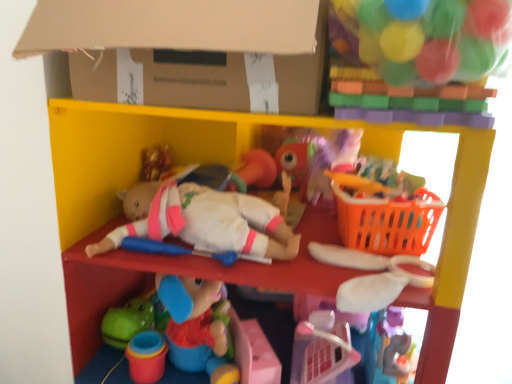
Question: Can you confirm if orange plastic basket at right is taller than cardboard at upper center?

Choices:
 (A) no
 (B) yes

Answer: (A)

Question: Does orange plastic basket at right have a larger size compared to cardboard at upper center?

Choices:
 (A) no
 (B) yes

Answer: (A)

Question: From a real-world perspective, is orange plastic basket at right located beneath cardboard at upper center?

Choices:
 (A) yes
 (B) no

Answer: (A)

Question: Is orange plastic basket at right behind cardboard at upper center?

Choices:
 (A) no
 (B) yes

Answer: (B)

Question: From the image's perspective, does orange plastic basket at right appear lower than cardboard at upper center?

Choices:
 (A) no
 (B) yes

Answer: (B)

Question: In terms of width, does white fabric bow at upper right, the 1th toy in the bottom-to-top sequence, look wider or thinner when compared to orange plastic basket at right?

Choices:
 (A) thin
 (B) wide

Answer: (B)

Question: From a real-world perspective, is white fabric bow at upper right, acting as the 2th toy starting from the top, above or below orange plastic basket at right?

Choices:
 (A) below
 (B) above

Answer: (A)

Question: Is point (401, 274) positioned closer to the camera than point (394, 216)?

Choices:
 (A) closer
 (B) farther

Answer: (A)

Question: From the image's perspective, is white fabric bow at upper right, acting as the 2th toy starting from the top, located above or below orange plastic basket at right?

Choices:
 (A) above
 (B) below

Answer: (B)

Question: Is translucent plastic balls at upper right, placed as the 1th toy when sorted from top to bottom, wider or thinner than cardboard at upper center?

Choices:
 (A) thin
 (B) wide

Answer: (A)

Question: Visually, is translucent plastic balls at upper right, placed as the 1th toy when sorted from top to bottom, positioned to the left or to the right of cardboard at upper center?

Choices:
 (A) right
 (B) left

Answer: (A)

Question: Based on their sizes in the image, would you say translucent plastic balls at upper right, which is counted as the second toy, starting from the bottom, is bigger or smaller than cardboard at upper center?

Choices:
 (A) small
 (B) big

Answer: (A)

Question: Is translucent plastic balls at upper right, which is counted as the second toy, starting from the bottom, in front of or behind cardboard at upper center in the image?

Choices:
 (A) front
 (B) behind

Answer: (A)

Question: In the image, is smooth plastic shelf at center positioned in front of or behind cardboard at upper center?

Choices:
 (A) front
 (B) behind

Answer: (B)

Question: Based on their sizes in the image, would you say smooth plastic shelf at center is bigger or smaller than cardboard at upper center?

Choices:
 (A) big
 (B) small

Answer: (A)